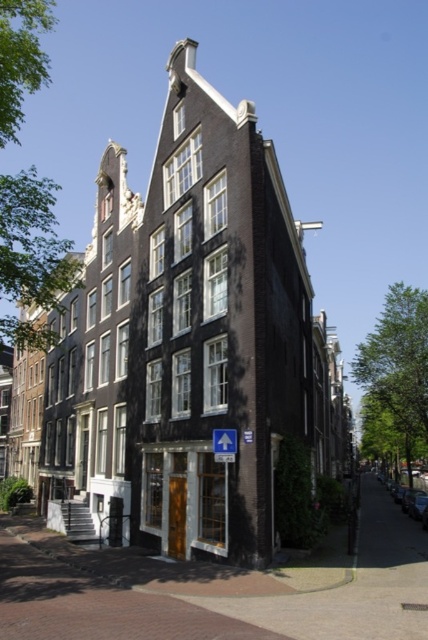
Between shiny silver sedan at right and blue plastic arrow at upper center, which one is positioned higher?

blue plastic arrow at upper center is above.

Does shiny silver sedan at right have a lesser height compared to blue plastic arrow at upper center?

Incorrect, shiny silver sedan at right's height does not fall short of blue plastic arrow at upper center's.

In the scene shown: Measure the distance between shiny silver sedan at right and camera.

43.41 meters

This screenshot has width=428, height=640. In order to click on shiny silver sedan at right in this screenshot , I will do `click(410, 500)`.